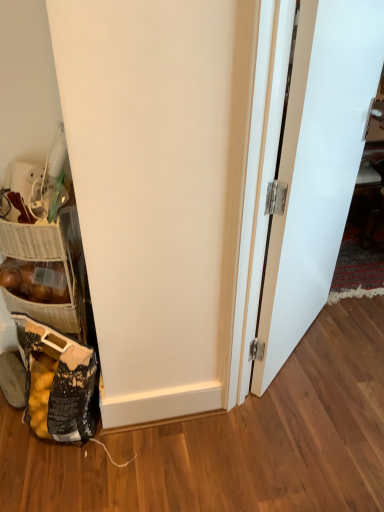
Question: Is woven brown basket at lower left not within white matte door at right?

Choices:
 (A) yes
 (B) no

Answer: (A)

Question: Can you confirm if woven brown basket at lower left is positioned to the right of white matte door at right?

Choices:
 (A) yes
 (B) no

Answer: (B)

Question: Can you confirm if woven brown basket at lower left is taller than white matte door at right?

Choices:
 (A) no
 (B) yes

Answer: (A)

Question: Considering the relative sizes of woven brown basket at lower left and white matte door at right in the image provided, is woven brown basket at lower left smaller than white matte door at right?

Choices:
 (A) no
 (B) yes

Answer: (B)

Question: Is woven brown basket at lower left with white matte door at right?

Choices:
 (A) yes
 (B) no

Answer: (B)

Question: From the image's perspective, does woven brown basket at lower left appear higher than white matte door at right?

Choices:
 (A) no
 (B) yes

Answer: (A)

Question: Considering the relative sizes of white matte door at right and woven brown basket at lower left in the image provided, is white matte door at right smaller than woven brown basket at lower left?

Choices:
 (A) no
 (B) yes

Answer: (A)

Question: Does white matte door at right have a greater height compared to woven brown basket at lower left?

Choices:
 (A) no
 (B) yes

Answer: (B)

Question: Is white matte door at right wider than woven brown basket at lower left?

Choices:
 (A) yes
 (B) no

Answer: (B)

Question: Is white matte door at right positioned in front of woven brown basket at lower left?

Choices:
 (A) yes
 (B) no

Answer: (A)

Question: Is white matte door at right located outside woven brown basket at lower left?

Choices:
 (A) yes
 (B) no

Answer: (A)

Question: Is woven brown basket at lower left a part of white matte door at right?

Choices:
 (A) no
 (B) yes

Answer: (A)

Question: Can you confirm if black plastic bag at lower left is thinner than woven brown basket at lower left?

Choices:
 (A) no
 (B) yes

Answer: (B)